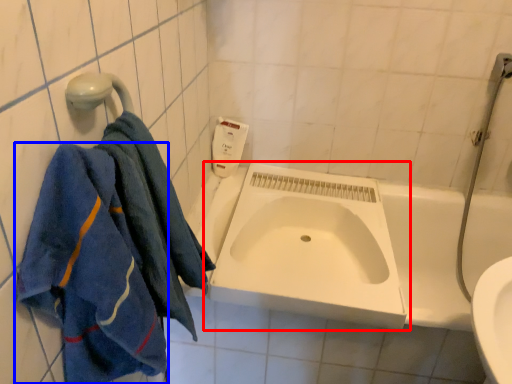
Question: Which object is further to the camera taking this photo, sink (highlighted by a red box) or towel (highlighted by a blue box)?

Choices:
 (A) sink
 (B) towel

Answer: (A)